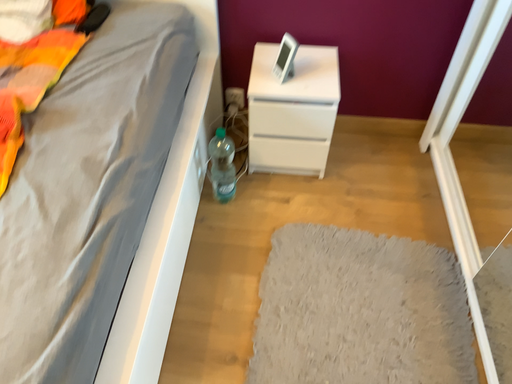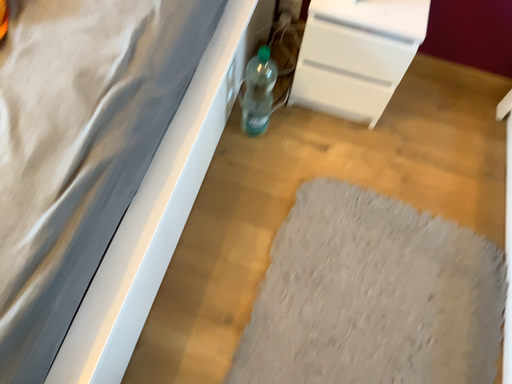
Question: Which way did the camera rotate in the video?

Choices:
 (A) rotated downward
 (B) rotated upward

Answer: (A)